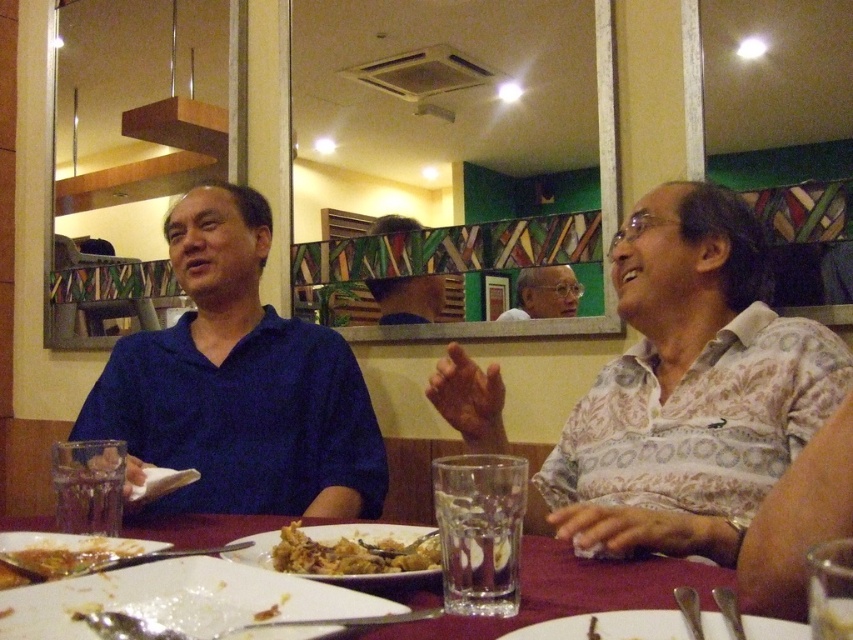
Can you confirm if white floral shirt at right is shorter than white glossy plate at center?

No, white floral shirt at right is not shorter than white glossy plate at center.

Which is above, white floral shirt at right or white glossy plate at center?

Positioned higher is white floral shirt at right.

What do you see at coordinates (688, 388) in the screenshot? The height and width of the screenshot is (640, 853). I see `white floral shirt at right` at bounding box center [688, 388].

At what (x,y) coordinates should I click in order to perform the action: click on white floral shirt at right. Please return your answer as a coordinate pair (x, y). The height and width of the screenshot is (640, 853). Looking at the image, I should click on (688, 388).

Does marble table at center have a lesser height compared to brown crispy fried food at lower left?

In fact, marble table at center may be taller than brown crispy fried food at lower left.

From the picture: Who is taller, marble table at center or brown crispy fried food at lower left?

marble table at center is taller.

Locate an element on the screen. marble table at center is located at coordinates tap(572, 592).

What are the coordinates of `marble table at center` in the screenshot? It's located at (572, 592).

Which is in front, point (670, 580) or point (711, 611)?

Point (711, 611) is more forward.

Where is `marble table at center`? marble table at center is located at coordinates (572, 592).